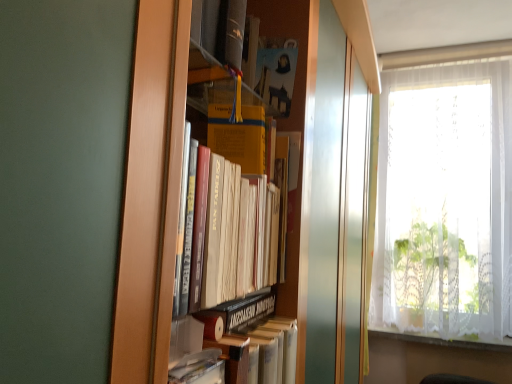
Describe the element at coordinates (445, 194) in the screenshot. I see `white lace curtain at right` at that location.

The image size is (512, 384). What are the coordinates of `hardcover book at center` in the screenshot? It's located at (236, 345).

You are a GUI agent. You are given a task and a screenshot of the screen. Output one action in this format:
    pyautogui.click(x=<x>, y=<y>)
    Task: Click on the white lace curtain at right
    The height and width of the screenshot is (384, 512).
    Given the screenshot: What is the action you would take?
    pyautogui.click(x=445, y=194)

In the scene shown: Is white lace curtain at right positioned with its back to hardcover book at center?

No, hardcover book at center is not at the back of white lace curtain at right.

Between white lace curtain at right and hardcover book at center, which one has larger width?

Wider between the two is white lace curtain at right.

Considering the sizes of objects white lace curtain at right and hardcover book at center in the image provided, who is shorter, white lace curtain at right or hardcover book at center?

Standing shorter between the two is hardcover book at center.

Which of these two, white lace curtain at lower right or white lace curtain at right, is bigger?

With larger size is white lace curtain at right.

Based on the photo, is white lace curtain at lower right looking in the opposite direction of white lace curtain at right?

white lace curtain at lower right does not have its back to white lace curtain at right.

Between white lace curtain at lower right and white lace curtain at right, which one has larger width?

With larger width is white lace curtain at right.

How distant is white lace curtain at lower right from white lace curtain at right?

white lace curtain at lower right is 23.73 inches from white lace curtain at right.

Considering the relative positions of white lace curtain at right and white lace curtain at lower right in the image provided, is white lace curtain at right to the left of white lace curtain at lower right from the viewer's perspective?

No, white lace curtain at right is not to the left of white lace curtain at lower right.

Identify the location of window sill that appears below the white lace curtain at right (from a real-world perspective). The image size is (512, 384). (445, 340).

Which is behind, point (490, 133) or point (503, 340)?

Positioned behind is point (490, 133).

Which object is closer to the camera, white lace curtain at right or white lace curtain at lower right?

white lace curtain at right is more forward.

Consider the image. Is hardcover book at center situated inside white lace curtain at right or outside?

hardcover book at center is spatially situated outside white lace curtain at right.

Considering the sizes of objects hardcover book at center and white lace curtain at right in the image provided, who is thinner, hardcover book at center or white lace curtain at right?

Thinner between the two is hardcover book at center.

From the image's perspective, is hardcover book at center above white lace curtain at right?

Incorrect, from the image's perspective, hardcover book at center is lower than white lace curtain at right.

In the scene shown: How distant is hardcover book at center from white lace curtain at right?

They are 1.64 meters apart.

Is white lace curtain at lower right turned away from hardcover book at center?

No, white lace curtain at lower right is not facing the opposite direction of hardcover book at center.

Is white lace curtain at lower right at the left side of hardcover book at center?

No.

In terms of width, does white lace curtain at lower right look wider or thinner when compared to hardcover book at center?

Clearly, white lace curtain at lower right has more width compared to hardcover book at center.

How far apart are white lace curtain at lower right and hardcover book at center?

white lace curtain at lower right is 1.64 meters away from hardcover book at center.

What's the angular difference between hardcover book at center and white lace curtain at lower right's facing directions?

92.7 degrees separate the facing orientations of hardcover book at center and white lace curtain at lower right.

Looking at this image, is hardcover book at center positioned with its back to white lace curtain at lower right?

No, hardcover book at center is not facing away from white lace curtain at lower right.

From the image's perspective, would you say hardcover book at center is positioned over white lace curtain at lower right?

Yes, from the image's perspective, hardcover book at center is over white lace curtain at lower right.

Is hardcover book at center completely or partially outside of white lace curtain at lower right?

Absolutely, hardcover book at center is external to white lace curtain at lower right.

Find the location of a particular element. The image size is (512, 384). book below the white lace curtain at right (from a real-world perspective) is located at coordinates (236, 345).

The width and height of the screenshot is (512, 384). What are the coordinates of `window sill that is below the white lace curtain at right (from the image's perspective)` in the screenshot? It's located at (445, 340).

Which object lies further to the anchor point white lace curtain at right, hardcover book at center or white lace curtain at lower right?

hardcover book at center.

Looking at the image, which one is located further to white lace curtain at lower right, white lace curtain at right or hardcover book at center?

hardcover book at center is further to white lace curtain at lower right.

From the picture: Based on their spatial positions, is white lace curtain at lower right or hardcover book at center further from white lace curtain at right?

hardcover book at center is positioned further to the anchor white lace curtain at right.

Looking at the image, which one is located further to hardcover book at center, white lace curtain at lower right or white lace curtain at right?

white lace curtain at lower right is positioned further to the anchor hardcover book at center.

Which object lies further to the anchor point hardcover book at center, white lace curtain at right or white lace curtain at lower right?

The object further to hardcover book at center is white lace curtain at lower right.

Based on their spatial positions, is hardcover book at center or white lace curtain at right further from white lace curtain at lower right?

hardcover book at center is further to white lace curtain at lower right.

I want to click on window between hardcover book at center and white lace curtain at lower right from front to back, so click(x=445, y=194).